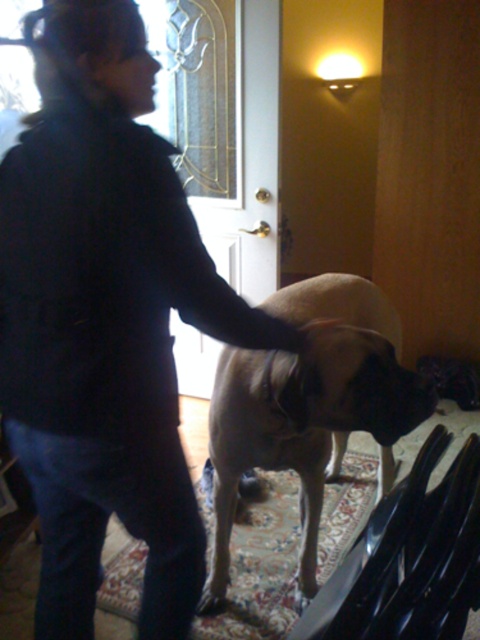
Question: Among these objects, which one is farthest from the camera?

Choices:
 (A) matte black dog at center
 (B) light brown fur at center

Answer: (B)

Question: Is matte black dog at center behind light brown fur at center?

Choices:
 (A) no
 (B) yes

Answer: (A)

Question: Does matte black dog at center have a greater width compared to light brown fur at center?

Choices:
 (A) yes
 (B) no

Answer: (B)

Question: Which object appears closest to the camera in this image?

Choices:
 (A) matte black dog at center
 (B) light brown fur at center

Answer: (A)

Question: Which object is farther from the camera taking this photo?

Choices:
 (A) light brown fur at center
 (B) matte black dog at center

Answer: (A)

Question: Observing the image, what is the correct spatial positioning of matte black dog at center in reference to light brown fur at center?

Choices:
 (A) right
 (B) left

Answer: (B)